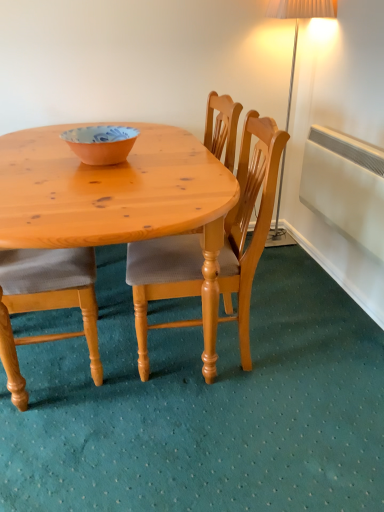
Question: From the image's perspective, is light brown wooden chair at center located above or below matte orange bowl at center?

Choices:
 (A) below
 (B) above

Answer: (A)

Question: In the image, is light brown wooden chair at center positioned in front of or behind matte orange bowl at center?

Choices:
 (A) behind
 (B) front

Answer: (B)

Question: Based on their relative distances, which object is farther from the white plastic radiator at right?

Choices:
 (A) light brown wooden chair at center
 (B) matte orange bowl at center

Answer: (B)

Question: Which of these objects is positioned closest to the matte orange bowl at center?

Choices:
 (A) white plastic radiator at right
 (B) light brown wooden chair at center

Answer: (B)